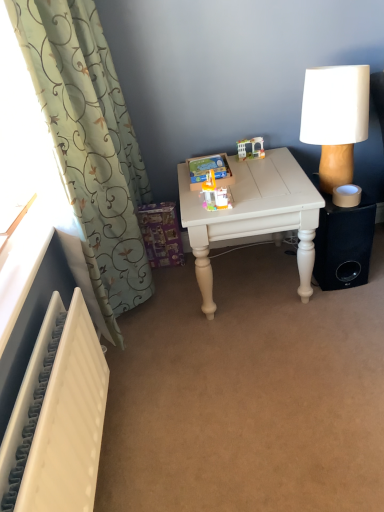
Question: Would you say translucent plastic toy at center, the first toy from the bottom, is part of green fabric curtain at left's contents?

Choices:
 (A) no
 (B) yes

Answer: (A)

Question: Is translucent plastic toy at center, positioned as the second toy in back-to-front order, at the back of green fabric curtain at left?

Choices:
 (A) yes
 (B) no

Answer: (A)

Question: From a real-world perspective, is green fabric curtain at left below translucent plastic toy at center, the 1th toy in the front-to-back sequence?

Choices:
 (A) no
 (B) yes

Answer: (A)

Question: Is green fabric curtain at left at the right side of translucent plastic toy at center, the 1th toy in the front-to-back sequence?

Choices:
 (A) no
 (B) yes

Answer: (A)

Question: Is green fabric curtain at left positioned beyond the bounds of translucent plastic toy at center, the 1th toy in the front-to-back sequence?

Choices:
 (A) no
 (B) yes

Answer: (B)

Question: Is green fabric curtain at left smaller than translucent plastic toy at center, positioned as the second toy in top-to-bottom order?

Choices:
 (A) no
 (B) yes

Answer: (A)

Question: Is white textured radiator at lower left thinner than white painted wood table at center?

Choices:
 (A) yes
 (B) no

Answer: (A)

Question: Is white painted wood table at center a part of white textured radiator at lower left?

Choices:
 (A) yes
 (B) no

Answer: (B)

Question: Does white textured radiator at lower left have a greater width compared to white painted wood table at center?

Choices:
 (A) no
 (B) yes

Answer: (A)

Question: Is white textured radiator at lower left touching white painted wood table at center?

Choices:
 (A) yes
 (B) no

Answer: (B)

Question: Are white textured radiator at lower left and white painted wood table at center far apart?

Choices:
 (A) yes
 (B) no

Answer: (B)

Question: Does white textured radiator at lower left have a larger size compared to white painted wood table at center?

Choices:
 (A) yes
 (B) no

Answer: (B)

Question: Does black matte speaker at lower right contain translucent plastic toy at center, positioned as the second toy in top-to-bottom order?

Choices:
 (A) no
 (B) yes

Answer: (A)